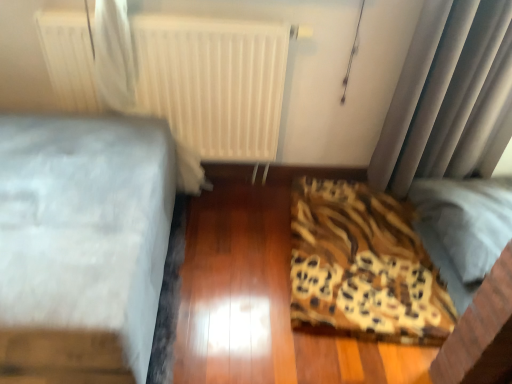
Find the location of `white fabric bed frame at left`. white fabric bed frame at left is located at coordinates (86, 224).

Describe the element at coordinates (86, 224) in the screenshot. I see `white fabric bed frame at left` at that location.

Where is `white fabric bed frame at left`? This screenshot has height=384, width=512. white fabric bed frame at left is located at coordinates (86, 224).